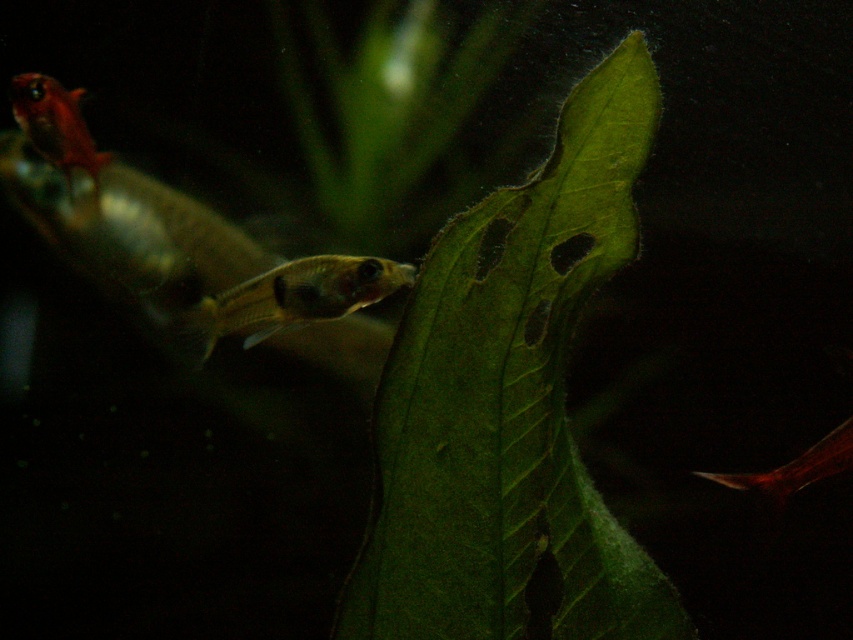
Question: Which of the following is the closest to the observer?

Choices:
 (A) (70, 141)
 (B) (828, 436)
 (C) (231, 307)
 (D) (85, 221)

Answer: (B)

Question: Can you confirm if matte orange fish at upper left is positioned below translucent red fish at lower right?

Choices:
 (A) yes
 (B) no

Answer: (B)

Question: Which of the following is the closest to the observer?

Choices:
 (A) (849, 460)
 (B) (383, 268)
 (C) (347, 262)

Answer: (A)

Question: Can you confirm if translucent yellow fish at center is positioned to the left of translucent red fish at lower right?

Choices:
 (A) yes
 (B) no

Answer: (A)

Question: Can you confirm if matte orange fish at upper left is thinner than translucent red fish at lower right?

Choices:
 (A) yes
 (B) no

Answer: (A)

Question: Estimate the real-world distances between objects in this image. Which object is farther from the matte orange fish at upper left?

Choices:
 (A) translucent yellow fish at center
 (B) translucent yellowish-green fish at center
 (C) translucent red fish at lower right

Answer: (C)